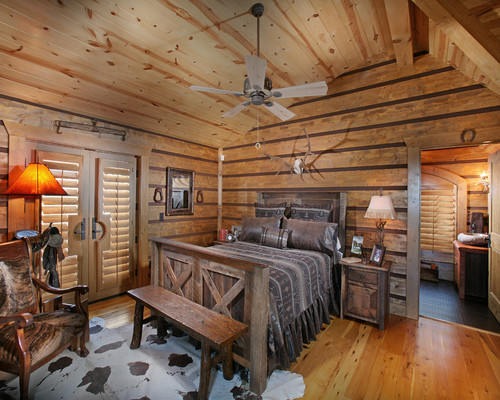
The image size is (500, 400). I want to click on lamp, so click(x=385, y=208).